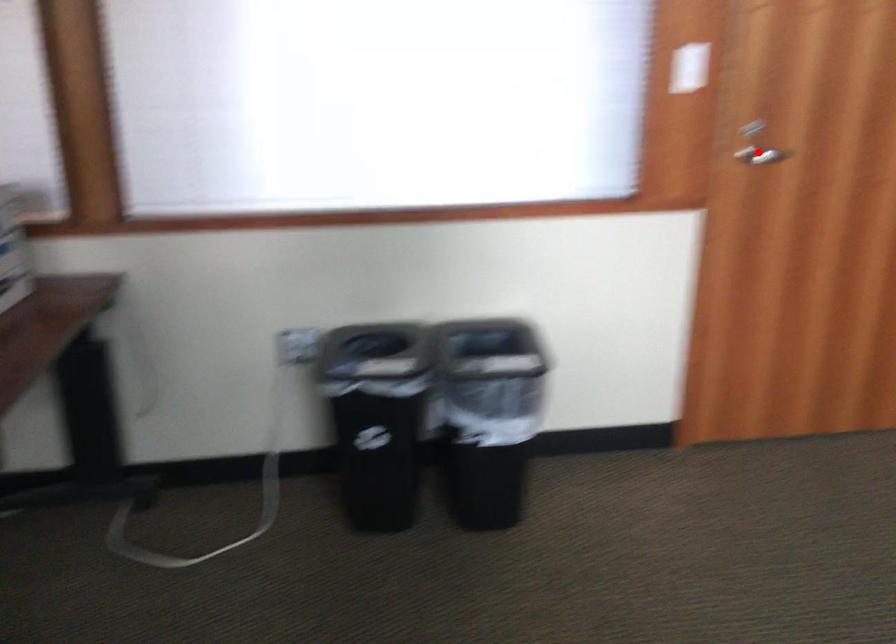
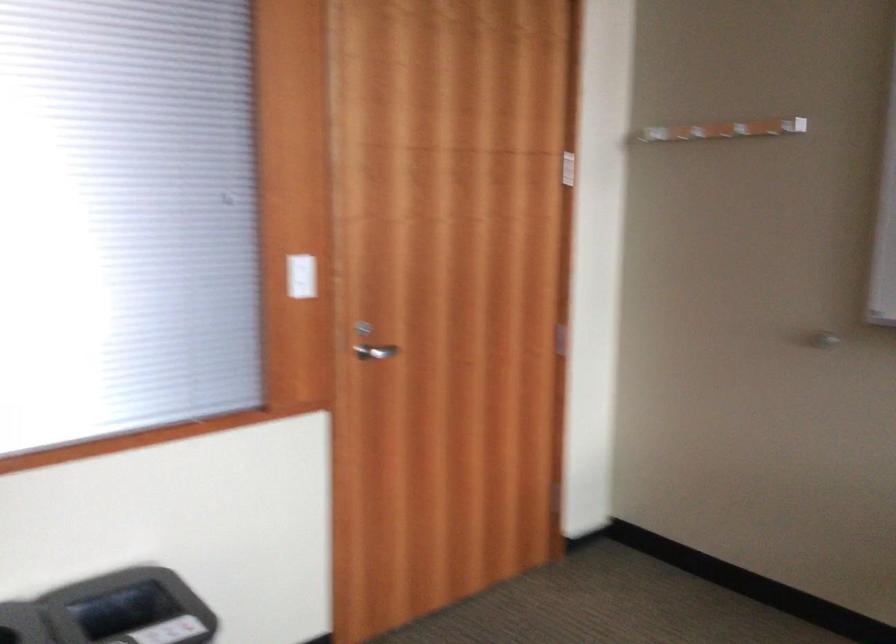
The point at the highlighted location is marked in the first image. Where is the corresponding point in the second image?

(375, 351)